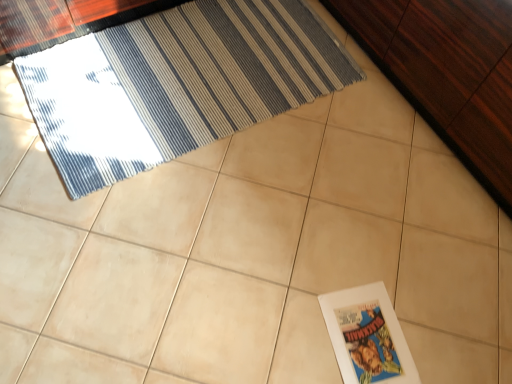
Question: From the image's perspective, is blue striped rug at upper left located beneath dark wood dresser at upper right?

Choices:
 (A) yes
 (B) no

Answer: (A)

Question: Is blue striped rug at upper left smaller than dark wood dresser at upper right?

Choices:
 (A) yes
 (B) no

Answer: (A)

Question: Does blue striped rug at upper left turn towards dark wood dresser at upper right?

Choices:
 (A) no
 (B) yes

Answer: (A)

Question: Is blue striped rug at upper left next to dark wood dresser at upper right?

Choices:
 (A) yes
 (B) no

Answer: (B)

Question: Would you say dark wood dresser at upper right is part of blue striped rug at upper left's contents?

Choices:
 (A) no
 (B) yes

Answer: (A)

Question: Considering their positions, is dark wood dresser at upper right located in front of or behind white paper at lower right?

Choices:
 (A) behind
 (B) front

Answer: (B)

Question: In terms of width, does dark wood dresser at upper right look wider or thinner when compared to white paper at lower right?

Choices:
 (A) wide
 (B) thin

Answer: (A)

Question: Is point (385, 11) positioned closer to the camera than point (352, 377)?

Choices:
 (A) closer
 (B) farther

Answer: (B)

Question: Is dark wood dresser at upper right inside or outside of white paper at lower right?

Choices:
 (A) inside
 (B) outside

Answer: (B)

Question: Would you say dark wood dresser at upper right is inside or outside blue striped rug at upper left?

Choices:
 (A) outside
 (B) inside

Answer: (A)

Question: Looking at the image, does dark wood dresser at upper right seem bigger or smaller compared to blue striped rug at upper left?

Choices:
 (A) small
 (B) big

Answer: (B)

Question: From the image's perspective, is dark wood dresser at upper right located above or below blue striped rug at upper left?

Choices:
 (A) below
 (B) above

Answer: (B)

Question: From a real-world perspective, is dark wood dresser at upper right positioned above or below blue striped rug at upper left?

Choices:
 (A) below
 (B) above

Answer: (B)

Question: Which is correct: blue striped rug at upper left is inside white paper at lower right, or outside of it?

Choices:
 (A) inside
 (B) outside

Answer: (B)

Question: Considering the positions of point (245, 56) and point (359, 324), is point (245, 56) closer or farther from the camera than point (359, 324)?

Choices:
 (A) closer
 (B) farther

Answer: (B)